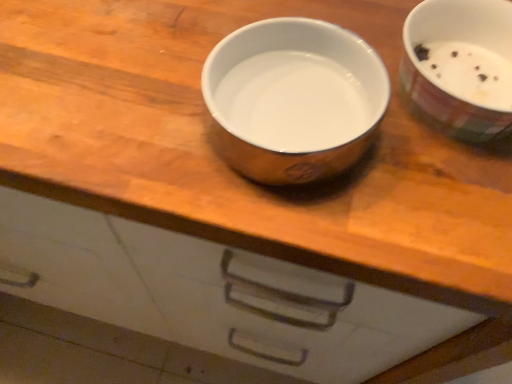
You are a GUI agent. You are given a task and a screenshot of the screen. Output one action in this format:
    pyautogui.click(x=<x>, y=<y>)
    Task: Click on the free space in front of satin silver bowl at center, marked as the 1th tableware in a left-to-right arrangement
    The height and width of the screenshot is (384, 512).
    Given the screenshot: What is the action you would take?
    pyautogui.click(x=307, y=233)